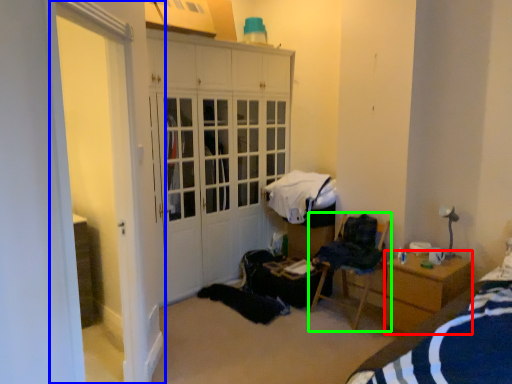
Question: Which is nearer to the desk (highlighted by a red box)? screen door (highlighted by a blue box) or chair (highlighted by a green box).

Choices:
 (A) screen door
 (B) chair

Answer: (B)